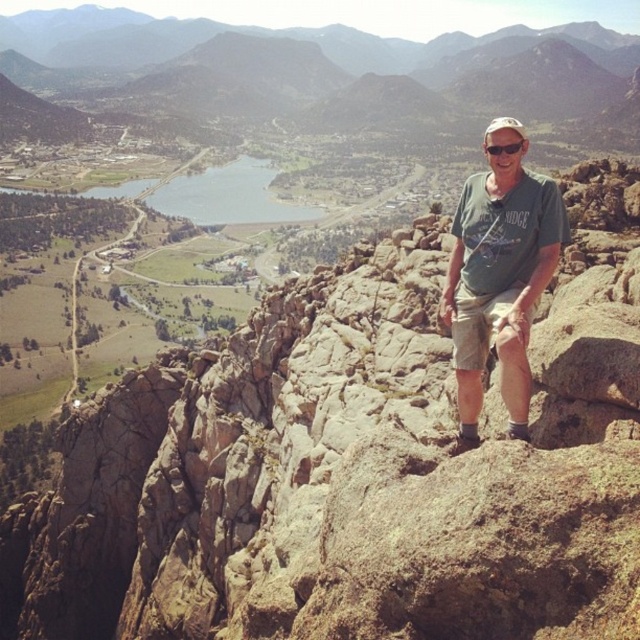
Based on the photo, measure the distance between brown rocky mountain at center and camera.

brown rocky mountain at center is 620.82 meters away from camera.

Is brown rocky mountain at center thinner than black plastic goggles at upper center?

Incorrect, brown rocky mountain at center's width is not less than black plastic goggles at upper center's.

Who is more forward, (532, 28) or (497, 150)?

Point (497, 150) is more forward.

Find the location of a particular element. This screenshot has height=640, width=640. brown rocky mountain at center is located at coordinates (268, 35).

Is green cotton t-shirt at center thinner than brown rocky mountain at center?

Yes, green cotton t-shirt at center is thinner than brown rocky mountain at center.

Does green cotton t-shirt at center appear over brown rocky mountain at center?

No, green cotton t-shirt at center is not above brown rocky mountain at center.

Is point (492, 250) farther from viewer compared to point (97, 20)?

No, it is in front of (97, 20).

Locate an element on the screen. green cotton t-shirt at center is located at coordinates (499, 282).

Who is higher up, green cotton t-shirt at center or black plastic goggles at upper center?

black plastic goggles at upper center is higher up.

Measure the distance between point [509,401] and camera.

Point [509,401] and camera are 132.92 feet apart from each other.

Identify the location of green cotton t-shirt at center. (499, 282).